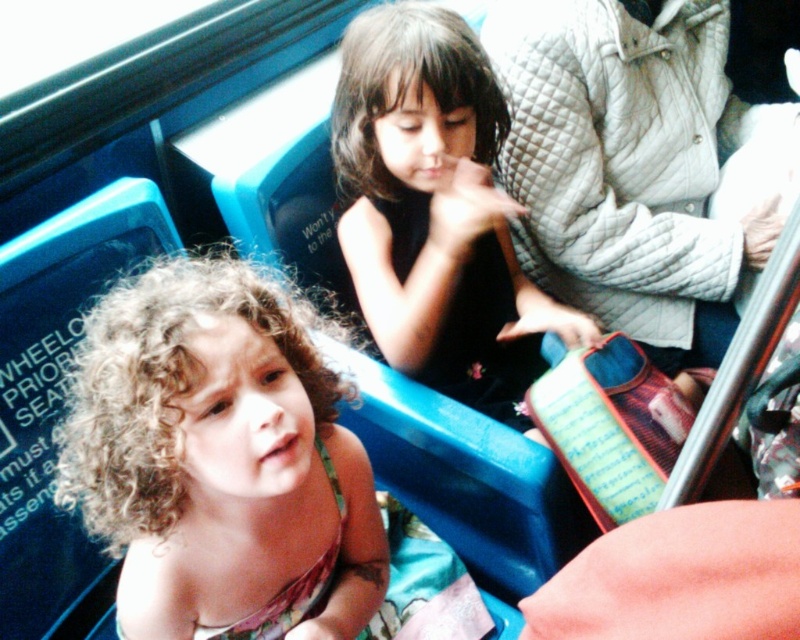
You are a passenger on a bus and see a young girl with curly hair at center and a person wearing a white quilted jacket at upper right. Which object takes up more space in the image?

The white quilted jacket at upper right takes up more space than the curly hair at center.

You are a passenger on the bus and see a young girl with curly hair at center and a child wearing a black matte dress at center. Which one is positioned to the left?

The curly hair at center is to the left of the black matte dress at center.